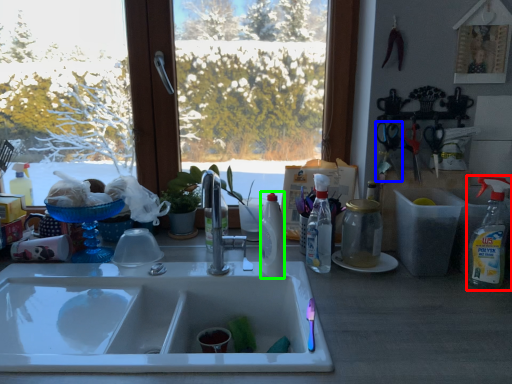
Question: Based on their relative distances, which object is nearer to cleaning product (highlighted by a red box)? Choose from scissors (highlighted by a blue box) and bottle (highlighted by a green box).

Choices:
 (A) scissors
 (B) bottle

Answer: (A)